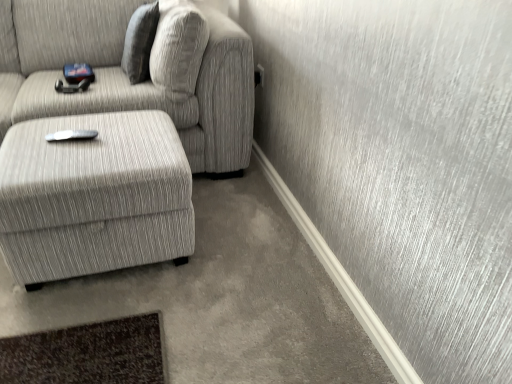
At what (x,y) coordinates should I click in order to perform the action: click on vacant area on top of textured gray ottoman at lower left (from a real-world perspective). Please return your answer as a coordinate pair (x, y). This screenshot has width=512, height=384. Looking at the image, I should click on (90, 137).